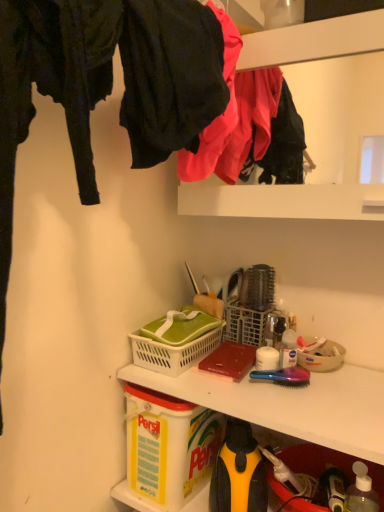
Where is `space that is in front of white plastic bottle at center, the 2th bottle in the right-to-left sequence`? Image resolution: width=384 pixels, height=512 pixels. space that is in front of white plastic bottle at center, the 2th bottle in the right-to-left sequence is located at coordinates (310, 403).